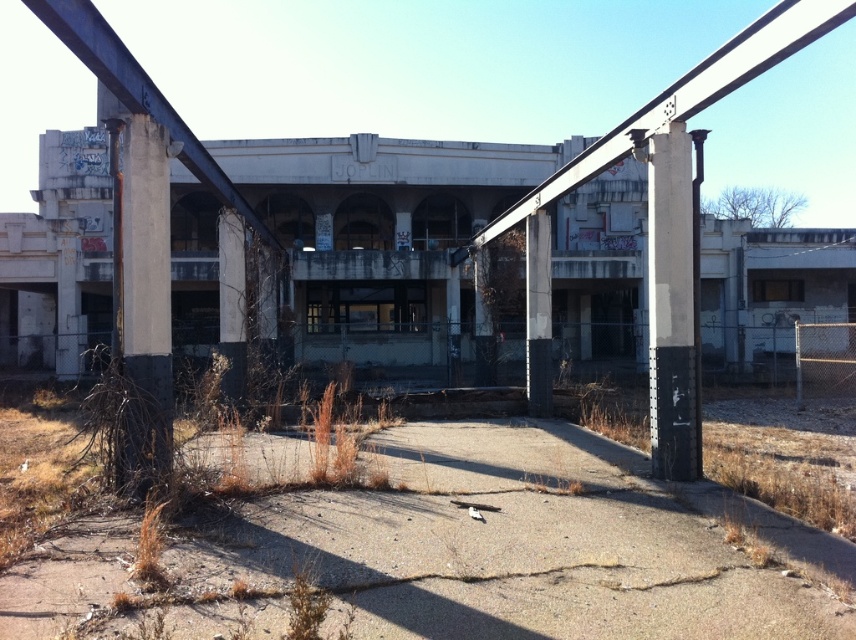
Question: Which point is farther from the camera taking this photo?

Choices:
 (A) (135, 364)
 (B) (239, 288)

Answer: (B)

Question: Which of the following is the closest to the observer?

Choices:
 (A) (152, 416)
 (B) (226, 262)
 (C) (135, 390)
 (D) (681, 444)

Answer: (C)

Question: In this image, where is brown dry grass at lower left located relative to concrete pillar at center?

Choices:
 (A) below
 (B) above

Answer: (A)

Question: Is brown dry grass at lower left positioned before concrete pillar at center?

Choices:
 (A) yes
 (B) no

Answer: (A)

Question: Is concrete pillar at center below concrete at center?

Choices:
 (A) yes
 (B) no

Answer: (B)

Question: Considering the real-world distances, which object is closest to the concrete pillar at left?

Choices:
 (A) brown dry grass at lower left
 (B) concrete pillar at center
 (C) black concrete pillar at right

Answer: (A)